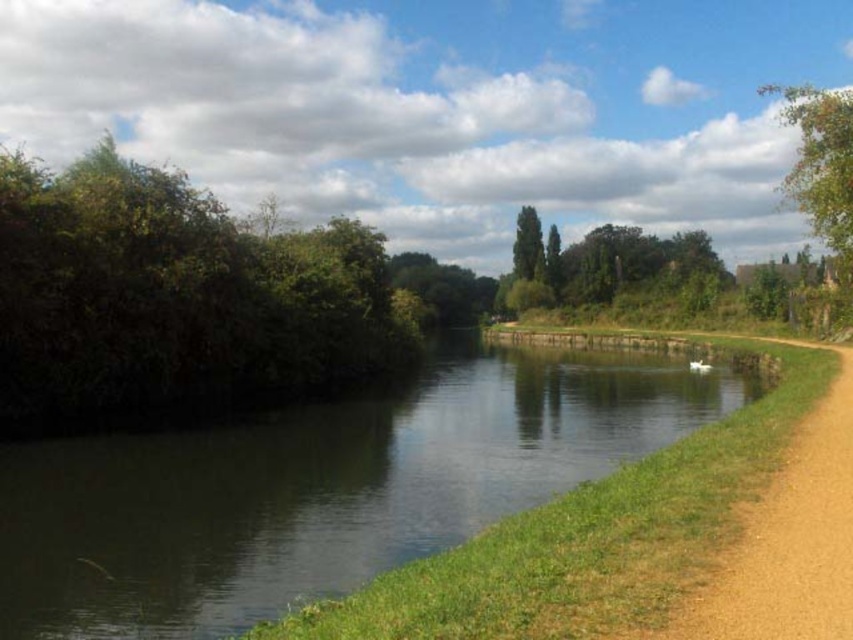
Can you confirm if green smooth water at center is taller than green leafy tree at upper right?

Incorrect, green smooth water at center's height is not larger of green leafy tree at upper right's.

What do you see at coordinates (320, 488) in the screenshot? I see `green smooth water at center` at bounding box center [320, 488].

Based on the photo, measure the distance between green smooth water at center and camera.

A distance of 33.84 feet exists between green smooth water at center and camera.

This screenshot has height=640, width=853. In order to click on green smooth water at center in this screenshot , I will do `click(320, 488)`.

Is green leafy bush at left positioned at the back of green leafy tree at upper right?

Yes, green leafy bush at left is further from the viewer.

Is point (152, 388) behind point (836, 134)?

That is True.

Locate an element on the screen. This screenshot has width=853, height=640. green leafy bush at left is located at coordinates (173, 296).

Looking at this image, who is higher up, green leafy tree at upper right or green leafy tree at center?

green leafy tree at upper right is higher up.

Locate an element on the screen. Image resolution: width=853 pixels, height=640 pixels. green leafy tree at upper right is located at coordinates (821, 161).